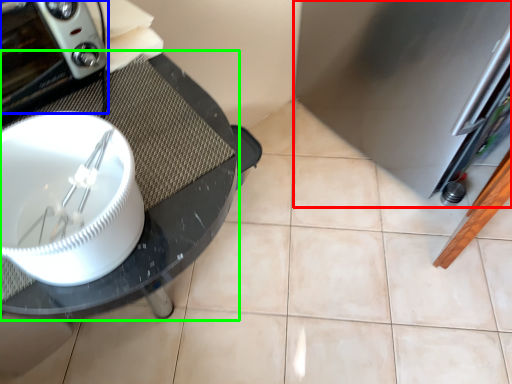
Question: Which is farther away from appliance (highlighted by a red box)? home appliance (highlighted by a blue box) or glass table (highlighted by a green box)?

Choices:
 (A) home appliance
 (B) glass table

Answer: (A)